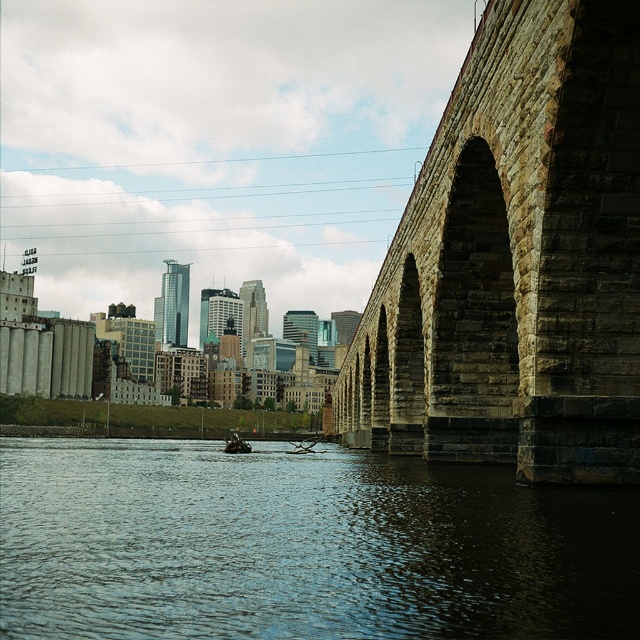
You are a GUI agent. You are given a task and a screenshot of the screen. Output one action in this format:
    pyautogui.click(x=<x>, y=<y>)
    Task: Click on the dark blue water at center
    The height and width of the screenshot is (640, 640).
    Given the screenshot: What is the action you would take?
    pyautogui.click(x=301, y=545)

Which is more to the left, dark blue water at center or stone arch bridge at right?

dark blue water at center

Is dark blue water at center bigger than stone arch bridge at right?

No, dark blue water at center is not bigger than stone arch bridge at right.

Locate an element on the screen. dark blue water at center is located at coordinates (301, 545).

Image resolution: width=640 pixels, height=640 pixels. In order to click on stone arch bridge at right in this screenshot , I will do `click(516, 260)`.

Is point (372, 438) closer to camera compared to point (244, 442)?

Yes, it is in front of point (244, 442).

Who is more distant from viewer, (x=557, y=477) or (x=244, y=451)?

Point (x=244, y=451)

Where is `stone arch bridge at right`? The width and height of the screenshot is (640, 640). stone arch bridge at right is located at coordinates (516, 260).